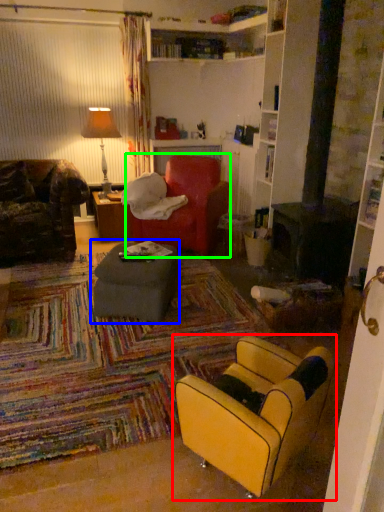
Question: Considering the real-world distances, which object is farthest from chair (highlighted by a red box)? table (highlighted by a blue box) or bean bag chair (highlighted by a green box)?

Choices:
 (A) table
 (B) bean bag chair

Answer: (B)